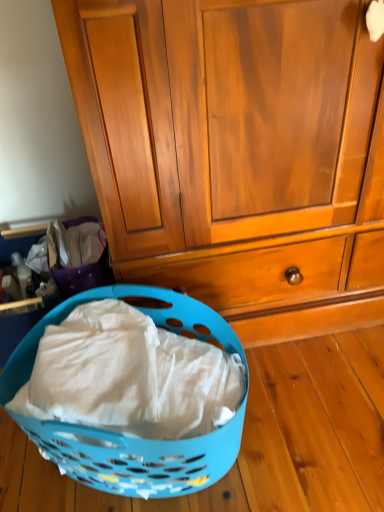
The width and height of the screenshot is (384, 512). Identify the location of blue plastic laundry basket at lower left. coord(121,434).

This screenshot has height=512, width=384. Describe the element at coordinates (121, 434) in the screenshot. I see `blue plastic laundry basket at lower left` at that location.

Where is `wooden cabinet at center`? Image resolution: width=384 pixels, height=512 pixels. wooden cabinet at center is located at coordinates (237, 153).

The image size is (384, 512). Describe the element at coordinates (237, 153) in the screenshot. I see `wooden cabinet at center` at that location.

At what (x,y) coordinates should I click in order to perform the action: click on blue plastic laundry basket at lower left. Please return your answer as a coordinate pair (x, y). Image resolution: width=384 pixels, height=512 pixels. Looking at the image, I should click on (121, 434).

Considering the relative positions of wooden cabinet at center and blue plastic laundry basket at lower left in the image provided, is wooden cabinet at center to the left or to the right of blue plastic laundry basket at lower left?

In the image, wooden cabinet at center appears on the right side of blue plastic laundry basket at lower left.

Looking at this image, considering their positions, is wooden cabinet at center located in front of or behind blue plastic laundry basket at lower left?

wooden cabinet at center is positioned farther from the viewer than blue plastic laundry basket at lower left.

Is point (303, 44) more distant than point (179, 476)?

No, it is not.

From the image's perspective, is wooden cabinet at center positioned above or below blue plastic laundry basket at lower left?

Based on their image positions, wooden cabinet at center is located above blue plastic laundry basket at lower left.

From a real-world perspective, which object stands above the other?

wooden cabinet at center is physically above.

Considering the relative sizes of wooden cabinet at center and blue plastic laundry basket at lower left in the image provided, is wooden cabinet at center thinner than blue plastic laundry basket at lower left?

No, wooden cabinet at center is not thinner than blue plastic laundry basket at lower left.

Between wooden cabinet at center and blue plastic laundry basket at lower left, which one has more height?

With more height is wooden cabinet at center.

Which of these two, wooden cabinet at center or blue plastic laundry basket at lower left, is bigger?

wooden cabinet at center.

Is blue plastic laundry basket at lower left inside wooden cabinet at center?

No, blue plastic laundry basket at lower left is located outside of wooden cabinet at center.

In the scene shown: Is the surface of wooden cabinet at center in direct contact with blue plastic laundry basket at lower left?

No, wooden cabinet at center is not making contact with blue plastic laundry basket at lower left.

Is wooden cabinet at center oriented away from blue plastic laundry basket at lower left?

That's not correct — wooden cabinet at center is not looking away from blue plastic laundry basket at lower left.

How many degrees apart are the facing directions of wooden cabinet at center and blue plastic laundry basket at lower left?

They differ by 49.8 degrees in their facing directions.

Measure the distance between wooden cabinet at center and blue plastic laundry basket at lower left.

A distance of 15.39 inches exists between wooden cabinet at center and blue plastic laundry basket at lower left.

Find the location of a particular element. picnic basket in front of the wooden cabinet at center is located at coordinates (121, 434).

Is blue plastic laundry basket at lower left at the right side of wooden cabinet at center?

Incorrect, blue plastic laundry basket at lower left is not on the right side of wooden cabinet at center.

In the image, is blue plastic laundry basket at lower left positioned in front of or behind wooden cabinet at center?

blue plastic laundry basket at lower left is positioned closer to the viewer than wooden cabinet at center.

Is point (27, 380) in front of point (264, 140)?

That is False.

Looking at this image, from the image's perspective, is blue plastic laundry basket at lower left located above wooden cabinet at center?

No.

From a real-world perspective, which object rests below the other?

In real-world perspective, blue plastic laundry basket at lower left is lower.

Is blue plastic laundry basket at lower left thinner than wooden cabinet at center?

Yes, blue plastic laundry basket at lower left is thinner than wooden cabinet at center.

Can you confirm if blue plastic laundry basket at lower left is shorter than wooden cabinet at center?

Yes, blue plastic laundry basket at lower left is shorter than wooden cabinet at center.

Does blue plastic laundry basket at lower left have a larger size compared to wooden cabinet at center?

Actually, blue plastic laundry basket at lower left might be smaller than wooden cabinet at center.

Is blue plastic laundry basket at lower left spatially inside wooden cabinet at center, or outside of it?

blue plastic laundry basket at lower left cannot be found inside wooden cabinet at center.

Is there a large distance between blue plastic laundry basket at lower left and wooden cabinet at center?

That's not correct — blue plastic laundry basket at lower left is a little close to wooden cabinet at center.

Is blue plastic laundry basket at lower left facing towards wooden cabinet at center?

No, blue plastic laundry basket at lower left is not oriented towards wooden cabinet at center.

At what (x,y) coordinates should I click in order to perform the action: click on cabinetry that appears on the right of blue plastic laundry basket at lower left. Please return your answer as a coordinate pair (x, y). This screenshot has width=384, height=512. Looking at the image, I should click on (237, 153).

Where is `cabinetry above the blue plastic laundry basket at lower left (from a real-world perspective)`? The width and height of the screenshot is (384, 512). cabinetry above the blue plastic laundry basket at lower left (from a real-world perspective) is located at coordinates (237, 153).

At what (x,y) coordinates should I click in order to perform the action: click on picnic basket in front of the wooden cabinet at center. Please return your answer as a coordinate pair (x, y). The image size is (384, 512). Looking at the image, I should click on (121, 434).